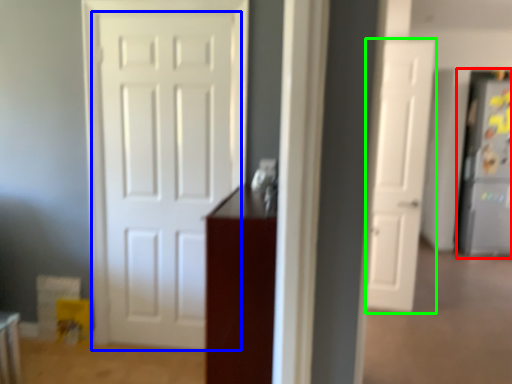
Question: Considering the real-world distances, which object is farthest from fridge (highlighted by a red box)? door (highlighted by a blue box) or door (highlighted by a green box)?

Choices:
 (A) door
 (B) door

Answer: (A)